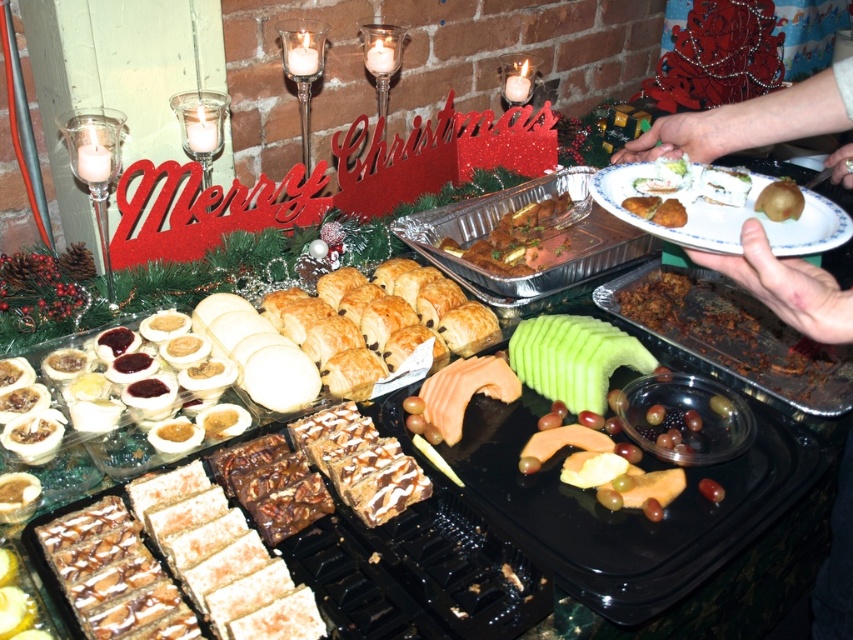
You are a guest at the holiday gathering and see the white glossy plate at upper right and the smooth skin hand at upper right. Which object is closer to you?

The smooth skin hand at upper right is closer to you because it is in front of the white glossy plate at upper right.

You are a guest at the holiday gathering and want to place a small dessert on the white glossy plate at upper right located at point [724,216]. Is there enough space around that plate to place your dessert without it overlapping with the nearby items?

The white glossy plate at upper right is located at point [724,216]. Since the scene description mentions the table is laden with an assortment of food items arranged neatly on black trays and plates, there might not be much space left around the plate. However, without specific spatial details about nearby items, it is uncertain if there is enough space to place the dessert without overlapping. Please check the arrangement carefully before placing your dessert.